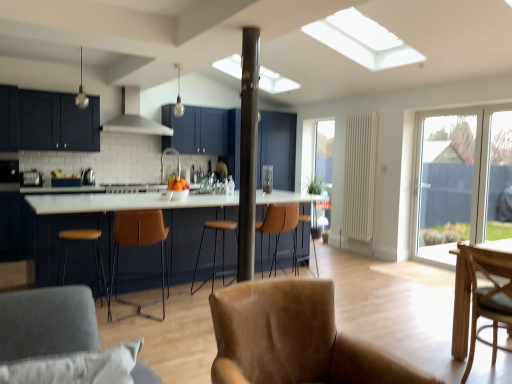
You are a GUI agent. You are given a task and a screenshot of the screen. Output one action in this format:
    pyautogui.click(x=<x>, y=<y>)
    Task: Click on the metallic silver kettle at center, placed as the third appliance when sorted from front to back
    
    Given the screenshot: What is the action you would take?
    pyautogui.click(x=88, y=177)

Image resolution: width=512 pixels, height=384 pixels. What do you see at coordinates (45, 320) in the screenshot? I see `gray fabric armchair at lower left, positioned as the 3th chair in right-to-left order` at bounding box center [45, 320].

This screenshot has height=384, width=512. What do you see at coordinates (304, 222) in the screenshot?
I see `brown leather bar stool at center, the first bar stool positioned from the right` at bounding box center [304, 222].

Image resolution: width=512 pixels, height=384 pixels. I want to click on satin silver toaster at left, the second appliance viewed from the front, so click(x=31, y=178).

Can you confirm if gray fabric armchair at lower left, which is counted as the fourth chair, starting from the back, is positioned to the left of transparent glass door at right?

Indeed, gray fabric armchair at lower left, which is counted as the fourth chair, starting from the back, is positioned on the left side of transparent glass door at right.

Between gray fabric armchair at lower left, positioned as the 3th chair in right-to-left order, and transparent glass door at right, which one is positioned in front?

gray fabric armchair at lower left, positioned as the 3th chair in right-to-left order, is closer to the camera.

From the image's perspective, which is below, gray fabric armchair at lower left, positioned as the 3th chair in right-to-left order, or transparent glass door at right?

gray fabric armchair at lower left, positioned as the 3th chair in right-to-left order.

How much distance is there between gray fabric armchair at lower left, positioned as the 3th chair in right-to-left order, and transparent glass door at right?

A distance of 17.06 feet exists between gray fabric armchair at lower left, positioned as the 3th chair in right-to-left order, and transparent glass door at right.

Considering the points (236, 177) and (37, 304), which point is in front, point (236, 177) or point (37, 304)?

The point (37, 304) is in front.

From a real-world perspective, who is located higher, matte dark blue cabinet at center, the second cabinetry viewed from the front, or gray fabric armchair at lower left, the 1th chair when ordered from front to back?

matte dark blue cabinet at center, the second cabinetry viewed from the front, from a real-world perspective.

Considering the sizes of objects matte dark blue cabinet at center, the second cabinetry viewed from the front, and gray fabric armchair at lower left, which is counted as the fourth chair, starting from the back, in the image provided, who is taller, matte dark blue cabinet at center, the second cabinetry viewed from the front, or gray fabric armchair at lower left, which is counted as the fourth chair, starting from the back,?

matte dark blue cabinet at center, the second cabinetry viewed from the front.

Is matte dark blue cabinet at center, which appears as the 1th cabinetry when viewed from the back, bigger or smaller than gray fabric armchair at lower left, the 1th chair when ordered from front to back?

matte dark blue cabinet at center, which appears as the 1th cabinetry when viewed from the back, is bigger than gray fabric armchair at lower left, the 1th chair when ordered from front to back.

Is transparent glass door at right closer to camera compared to transparent glass door at right?

No.

From the picture: From a real-world perspective, is transparent glass door at right positioned over transparent glass door at right based on gravity?

No, from a real-world perspective, transparent glass door at right is not on top of transparent glass door at right.

Is transparent glass door at right at the back of transparent glass door at right?

No.

Between transparent glass door at right and transparent glass door at right, which one has more height?

transparent glass door at right is taller.

Can you tell me how much brown leather bar stool at center, the first bar stool positioned from the back, and brown leather bar stool at center, acting as the 2th bar stool starting from the right, differ in facing direction?

The angle between the facing direction of brown leather bar stool at center, the first bar stool positioned from the back, and the facing direction of brown leather bar stool at center, acting as the 2th bar stool starting from the right, is 4.38 degrees.

I want to click on the 1st bar stool below when counting from the brown leather bar stool at center, arranged as the second bar stool when viewed from the back (from the image's perspective), so click(x=304, y=222).

Based on the photo, is brown leather bar stool at center, the first bar stool positioned from the right, shorter than brown leather bar stool at center, acting as the second bar stool starting from the left?

In fact, brown leather bar stool at center, the first bar stool positioned from the right, may be taller than brown leather bar stool at center, acting as the second bar stool starting from the left.

Between brown leather bar stool at center, the 3th bar stool from the left, and brown leather bar stool at center, marked as the second bar stool in a front-to-back arrangement, which one is positioned behind?

brown leather bar stool at center, the 3th bar stool from the left, is more distant.

Considering the points (111, 315) and (1, 118), which point is behind, point (111, 315) or point (1, 118)?

Point (1, 118)

Is brown leather chair at center, marked as the fourth chair in a right-to-left arrangement, next to matte black cabinets at left, marked as the 2th cabinetry in a right-to-left arrangement?

No, brown leather chair at center, marked as the fourth chair in a right-to-left arrangement, is not beside matte black cabinets at left, marked as the 2th cabinetry in a right-to-left arrangement.

Would you say brown leather chair at center, marked as the 1th chair in a back-to-front arrangement, is outside matte black cabinets at left, arranged as the 1th cabinetry when viewed from the front?

Yes, brown leather chair at center, marked as the 1th chair in a back-to-front arrangement, is outside of matte black cabinets at left, arranged as the 1th cabinetry when viewed from the front.

Can you tell me how much brown leather chair at center, which is the 4th chair in front-to-back order, and matte black cabinets at left, arranged as the 1th cabinetry when viewed from the front, differ in facing direction?

174 degrees.

Is matte dark blue cabinet at center, the second cabinetry viewed from the left, wider or thinner than leather armchair at center, the 3th chair when ordered from back to front?

matte dark blue cabinet at center, the second cabinetry viewed from the left, is thinner than leather armchair at center, the 3th chair when ordered from back to front.

How many degrees apart are the facing directions of matte dark blue cabinet at center, which is the 1th cabinetry in right-to-left order, and leather armchair at center, which ranks as the 2th chair in front-to-back order?

14.3 degrees.

Consider the image. Based on their sizes in the image, would you say matte dark blue cabinet at center, the second cabinetry viewed from the left, is bigger or smaller than leather armchair at center, positioned as the 3th chair in left-to-right order?

Considering their sizes, matte dark blue cabinet at center, the second cabinetry viewed from the left, takes up more space than leather armchair at center, positioned as the 3th chair in left-to-right order.

Considering the positions of objects matte dark blue cabinet at center, the second cabinetry viewed from the left, and leather armchair at center, marked as the 2th chair in a right-to-left arrangement, in the image provided, who is more to the left, matte dark blue cabinet at center, the second cabinetry viewed from the left, or leather armchair at center, marked as the 2th chair in a right-to-left arrangement,?

From the viewer's perspective, matte dark blue cabinet at center, the second cabinetry viewed from the left, appears more on the left side.

Which object is positioned more to the right, brown leather chair at center, which is the 4th chair in front-to-back order, or brown leather bar stool at center, the 3th bar stool in the front-to-back sequence?

Positioned to the right is brown leather bar stool at center, the 3th bar stool in the front-to-back sequence.

Looking at their sizes, would you say brown leather chair at center, which is the 4th chair in front-to-back order, is wider or thinner than brown leather bar stool at center, the 3th bar stool from the left?

In the image, brown leather chair at center, which is the 4th chair in front-to-back order, appears to be wider than brown leather bar stool at center, the 3th bar stool from the left.

Based on the photo, is brown leather bar stool at center, the 3th bar stool in the front-to-back sequence, surrounded by brown leather chair at center, marked as the fourth chair in a right-to-left arrangement?

No.

At what (x,y) coordinates should I click in order to perform the action: click on window located behind the gray fabric armchair at lower left, the 1th chair when ordered from front to back. Please return your answer as a coordinate pair (x, y). This screenshot has height=384, width=512. Looking at the image, I should click on (462, 179).

Which chair is the 1st one when counting from the left side of the matte dark blue cabinet at center, the second cabinetry viewed from the front? Please provide its 2D coordinates.

[(45, 320)]

Which object lies nearer to the anchor point gray fabric armchair at lower left, positioned as the 3th chair in right-to-left order, brown leather bar stool at left, which appears as the 3th bar stool when viewed from the back, or satin silver toaster at left, the 2th appliance when ordered from back to front?

brown leather bar stool at left, which appears as the 3th bar stool when viewed from the back, is positioned closer to the anchor gray fabric armchair at lower left, positioned as the 3th chair in right-to-left order.

Considering their positions, is brown leather bar stool at center, the 3th bar stool from the left, positioned closer to wooden textured chair at right, arranged as the second chair when viewed from the back, than matte black cabinets at left, arranged as the 1th cabinetry when viewed from the front?

brown leather bar stool at center, the 3th bar stool from the left, lies closer to wooden textured chair at right, arranged as the second chair when viewed from the back, than the other object.

From the image, which object appears to be farther from metallic pole at center, brown leather bar stool at center, acting as the second bar stool starting from the left, or brown leather bar stool at left, the 1th bar stool in the front-to-back sequence?

brown leather bar stool at left, the 1th bar stool in the front-to-back sequence, is further to metallic pole at center.

Estimate the real-world distances between objects in this image. Which object is closer to white matte exhaust hood at upper center, satin silver toaster at left, arranged as the 3th appliance when viewed from the right, or matte dark blue cabinet at center, the second cabinetry viewed from the left?

Based on the image, satin silver toaster at left, arranged as the 3th appliance when viewed from the right, appears to be nearer to white matte exhaust hood at upper center.

Based on their spatial positions, is brown leather bar stool at left, the 1th bar stool in the front-to-back sequence, or wooden textured chair at right, the third chair from the front, further from white glossy table at center?

wooden textured chair at right, the third chair from the front, lies further to white glossy table at center than the other object.

Which object lies nearer to the anchor point metallic pole at center, metallic glass at center, the 1th appliance when ordered from front to back, or brown leather bar stool at center, arranged as the second bar stool when viewed from the back?

brown leather bar stool at center, arranged as the second bar stool when viewed from the back, is positioned closer to the anchor metallic pole at center.

From the image, which object appears to be farther from metallic pole at center, wooden textured chair at right, the third chair from the front, or brown leather chair at center, marked as the 1th chair in a back-to-front arrangement?

Based on the image, wooden textured chair at right, the third chair from the front, appears to be further to metallic pole at center.

Estimate the real-world distances between objects in this image. Which object is closer to white matte exhaust hood at upper center, metallic glass at center, which is the first appliance from right to left, or wooden textured chair at right, arranged as the second chair when viewed from the back?

metallic glass at center, which is the first appliance from right to left, lies closer to white matte exhaust hood at upper center than the other object.

The image size is (512, 384). Find the location of `bar stool located between gray fabric armchair at lower left, which is counted as the 2th chair, starting from the left, and brown leather bar stool at center, arranged as the second bar stool when viewed from the back, in the depth direction`. bar stool located between gray fabric armchair at lower left, which is counted as the 2th chair, starting from the left, and brown leather bar stool at center, arranged as the second bar stool when viewed from the back, in the depth direction is located at coordinates click(x=93, y=254).

This screenshot has height=384, width=512. I want to click on cabinetry positioned between brown leather bar stool at left, placed as the 1th bar stool when sorted from left to right, and white matte exhaust hood at upper center from near to far, so click(47, 121).

You are a GUI agent. You are given a task and a screenshot of the screen. Output one action in this format:
    pyautogui.click(x=<x>, y=<y>)
    Task: Click on the cabinetry between satin silver toaster at left, which is the 1th appliance in left-to-right order, and brown leather bar stool at center, acting as the second bar stool starting from the left, from left to right
    The height and width of the screenshot is (384, 512).
    Given the screenshot: What is the action you would take?
    pyautogui.click(x=47, y=121)

Identify the location of bar stool between matte dark blue cabinet at center, the second cabinetry viewed from the front, and transparent glass door at right. The image size is (512, 384). (304, 222).